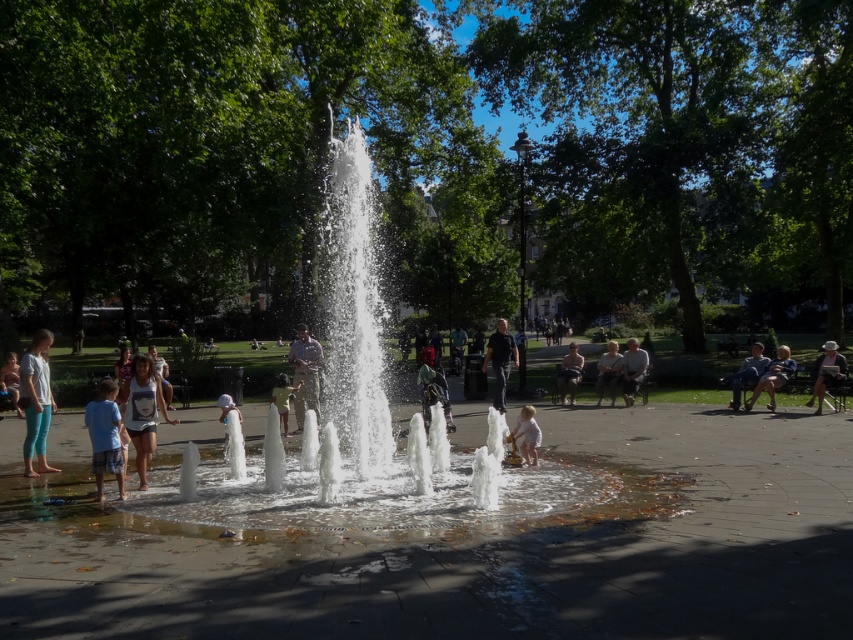
Is point (364, 451) farther from viewer compared to point (143, 464)?

Yes, point (364, 451) is farther from viewer.

Between clear water at center and white tank top at center, which one is positioned lower?

white tank top at center is below.

The image size is (853, 640). What are the coordinates of `clear water at center` in the screenshot? It's located at (355, 312).

Can you confirm if white matte dress at center is smaller than light brown wooden bench at lower left?

Correct, white matte dress at center occupies less space than light brown wooden bench at lower left.

Between white matte dress at center and light brown wooden bench at lower left, which one is positioned lower?

white matte dress at center is below.

Describe the element at coordinates (527, 433) in the screenshot. I see `white matte dress at center` at that location.

You are a GUI agent. You are given a task and a screenshot of the screen. Output one action in this format:
    pyautogui.click(x=<x>, y=<y>)
    Task: Click on the white matte dress at center
    
    Given the screenshot: What is the action you would take?
    pyautogui.click(x=527, y=433)

Is point (149, 406) less distant than point (569, 358)?

Yes, point (149, 406) is in front of point (569, 358).

Describe the element at coordinates (142, 410) in the screenshot. I see `white tank top at center` at that location.

You are a GUI agent. You are given a task and a screenshot of the screen. Output one action in this format:
    pyautogui.click(x=<x>, y=<y>)
    Task: Click on the white tank top at center
    
    Given the screenshot: What is the action you would take?
    pyautogui.click(x=142, y=410)

Locate an element on the screen. This screenshot has height=640, width=853. white tank top at center is located at coordinates (142, 410).